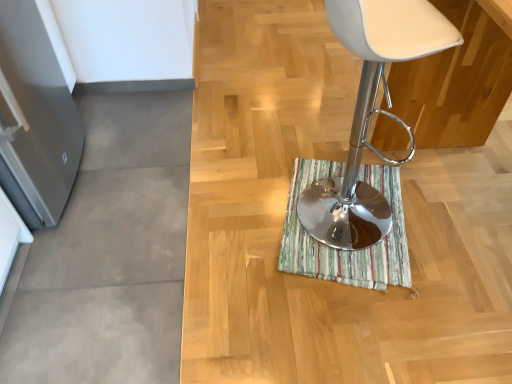
Identify the location of vacant space in front of striped fabric bath mat at center. Image resolution: width=512 pixels, height=384 pixels. (362, 328).